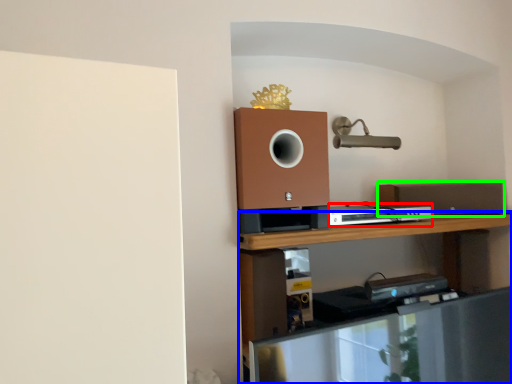
Question: Based on their relative distances, which object is nearer to appliance (highlighted by a red box)? Choose from shelf (highlighted by a blue box) and speaker (highlighted by a green box).

Choices:
 (A) shelf
 (B) speaker

Answer: (A)